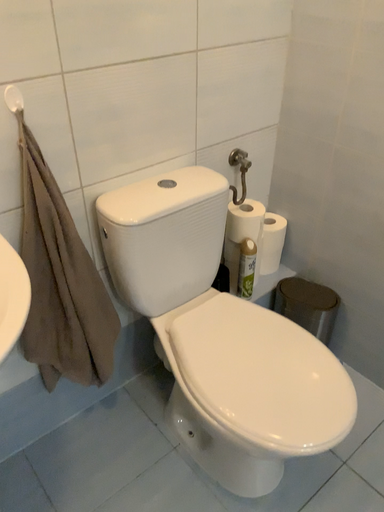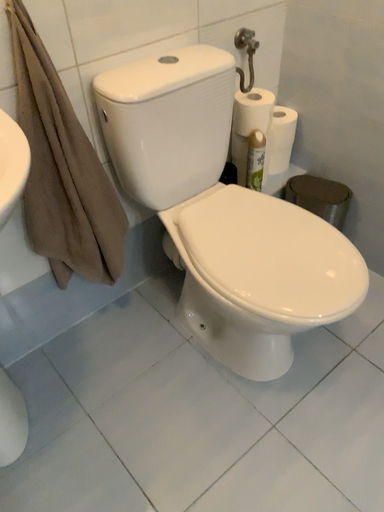
Question: How did the camera likely rotate when shooting the video?

Choices:
 (A) rotated upward
 (B) rotated downward

Answer: (B)